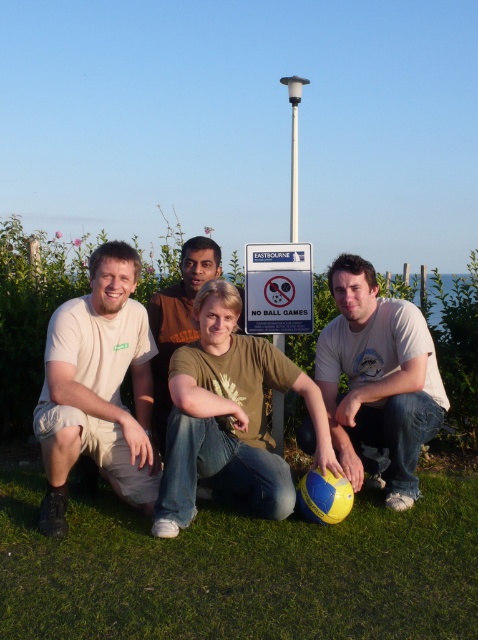
You are a volleyball coach who wants to ensure proper spacing between players during a drill. The volleyball at center is part of the drill setup. If the players are positioned as in the image, are they spaced appropriately according to standard volleyball drill requirements that require players to be at least 3 meters apart?

The players are 3.33 meters apart, so they are spaced appropriately as they meet the minimum requirement of 3 meters apart for the volleyball drill.